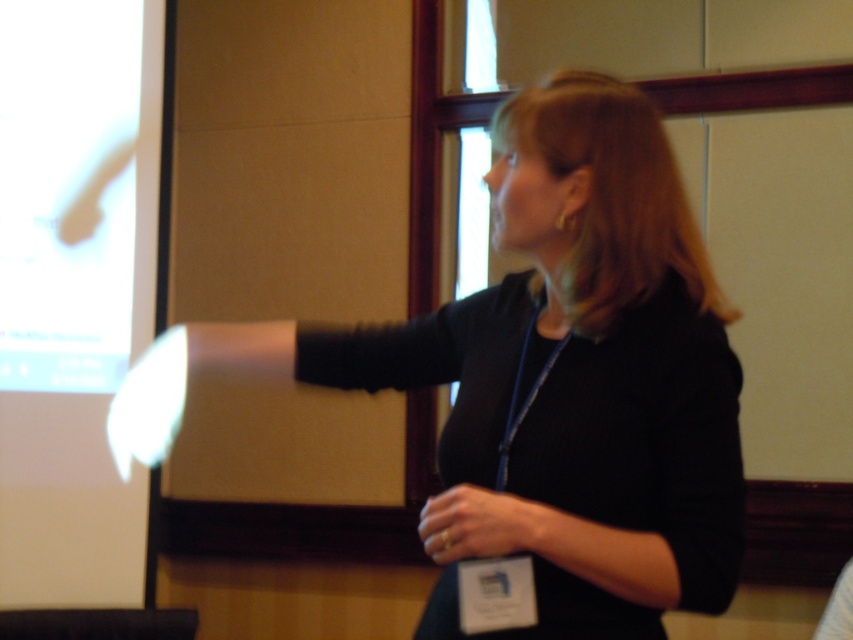
You are an event organizer who needs to ensure that the white glossy projection screen at left is visible to all attendees. Considering the black matte shirt at center, which object is wider and could potentially block the view of the screen?

The black matte shirt at center might be wider than the white glossy projection screen at left, so it could block the view of the screen.

You are an attendee at a conference and notice the presenter wearing a black matte shirt at center and a gold ring at center. From your perspective, which item is positioned more to the left?

The black matte shirt at center is positioned to the left of the gold ring at center, so the black matte shirt at center is more to the left.